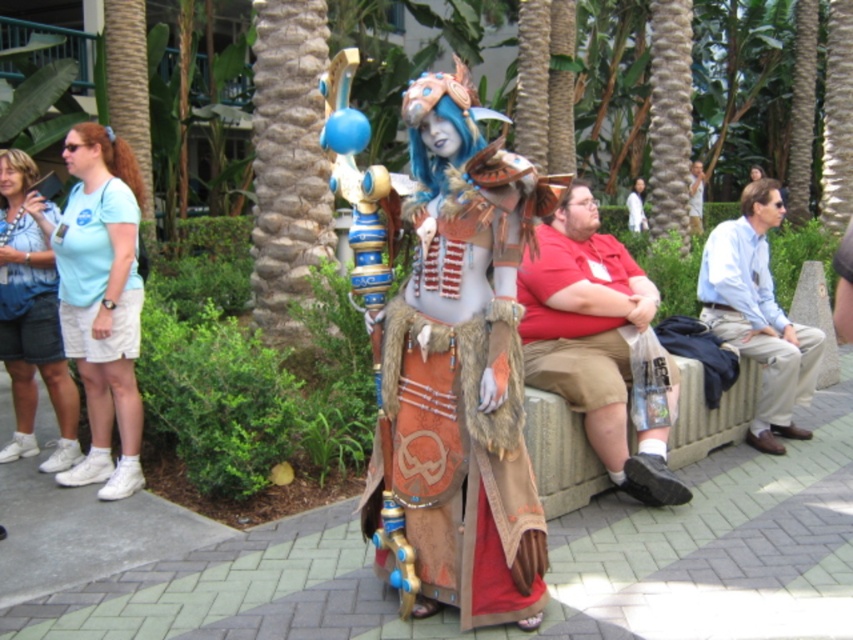
Question: Does matte blue shirt at left have a greater width compared to light blue cotton t-shirt at left?

Choices:
 (A) yes
 (B) no

Answer: (A)

Question: Which point is farther from the camera taking this photo?

Choices:
 (A) (x=80, y=216)
 (B) (x=79, y=204)
 (C) (x=631, y=204)
 (D) (x=759, y=333)

Answer: (C)

Question: Which point is closer to the camera?

Choices:
 (A) light blue shirt at right
 (B) light blue fabric shirt at upper left
 (C) white matte shirt at center

Answer: (B)

Question: Can you confirm if leather and fur armor at center is bigger than white matte shirt at center?

Choices:
 (A) no
 (B) yes

Answer: (A)

Question: Estimate the real-world distances between objects in this image. Which object is closer to the white matte shirt at center?

Choices:
 (A) matte blue shirt at left
 (B) light blue shirt at center
 (C) light blue fabric shirt at upper left
 (D) leather and fur armor at center

Answer: (B)

Question: Can you confirm if light blue shirt at right is positioned below matte blue shirt at left?

Choices:
 (A) yes
 (B) no

Answer: (A)